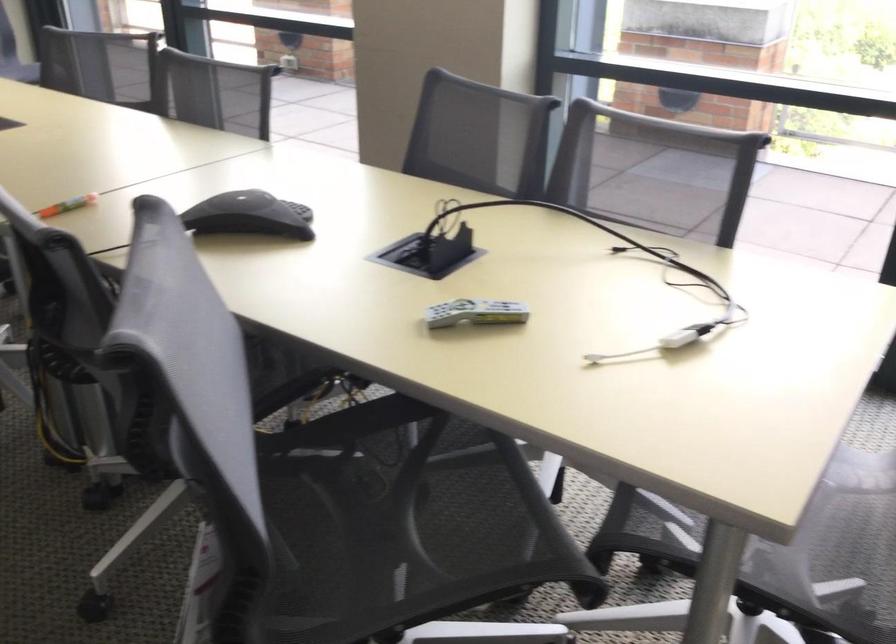
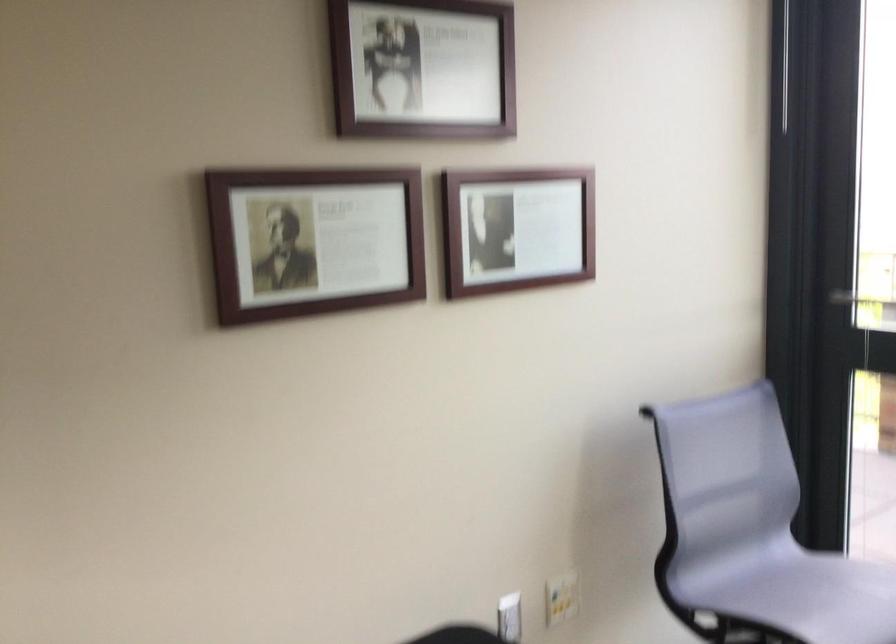
What movement of the cameraman would produce the second image?

The cameraman moved toward left, forward.